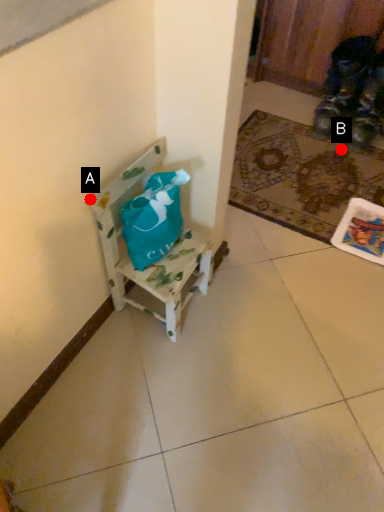
Question: Two points are circled on the image, labeled by A and B beside each circle. Which point appears closest to the camera in this image?

Choices:
 (A) A is closer
 (B) B is closer

Answer: (A)